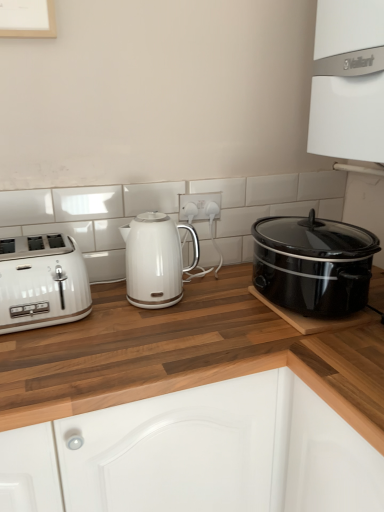
The image size is (384, 512). Find the location of `vacant space situated on the left part of white glossy kettle at center`. vacant space situated on the left part of white glossy kettle at center is located at coordinates (105, 304).